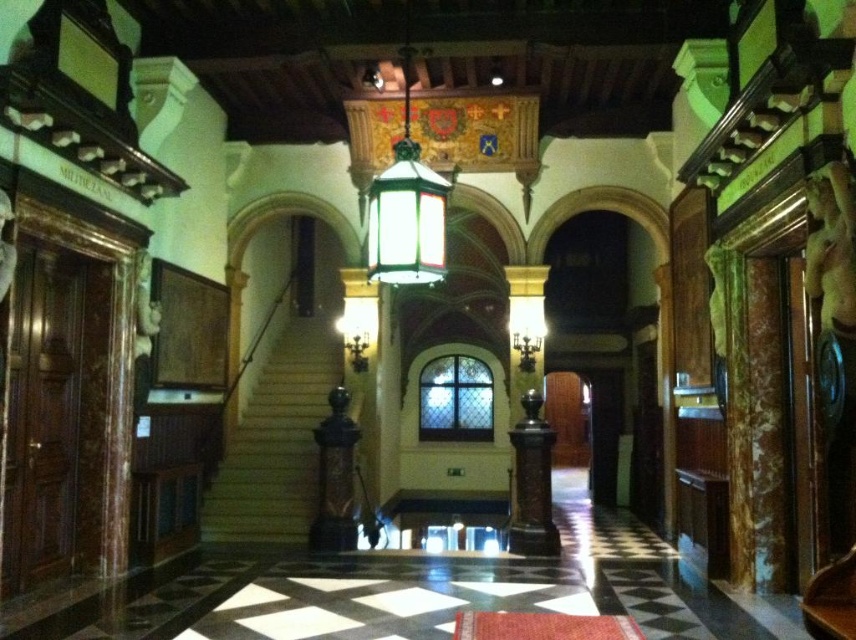
Question: Is wooden staircase at center bigger than brown polished wood pillar at center?

Choices:
 (A) no
 (B) yes

Answer: (B)

Question: Where is wooden staircase at center located in relation to brown polished wood pillar at center in the image?

Choices:
 (A) above
 (B) below

Answer: (A)

Question: Which point is closer to the camera?

Choices:
 (A) brown polished wood pillar at center
 (B) wooden staircase at center

Answer: (A)

Question: Can you confirm if wooden staircase at center is thinner than brown polished wood pillar at center?

Choices:
 (A) yes
 (B) no

Answer: (B)

Question: Which point appears closest to the camera in this image?

Choices:
 (A) (330, 381)
 (B) (545, 499)

Answer: (B)